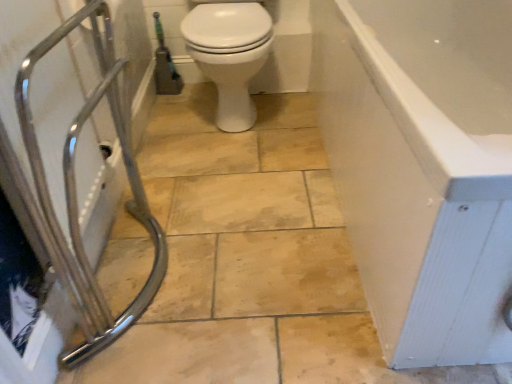
This screenshot has height=384, width=512. I want to click on white glossy toilet at center, so click(x=230, y=55).

What do you see at coordinates (423, 167) in the screenshot? I see `white glossy bathtub at right` at bounding box center [423, 167].

Image resolution: width=512 pixels, height=384 pixels. In order to click on chrome metallic shower at left in this screenshot , I will do `click(75, 185)`.

Identify the location of garden hose behind the chrome metallic shower at left. [x=165, y=65].

Does green rubber garden hose at upper left appear on the left side of chrome metallic shower at left?

Indeed, green rubber garden hose at upper left is positioned on the left side of chrome metallic shower at left.

Which is less distant, (159, 50) or (68, 214)?

The point (68, 214) is in front.

Does green rubber garden hose at upper left have a lesser width compared to chrome metallic shower at left?

Correct, the width of green rubber garden hose at upper left is less than that of chrome metallic shower at left.

Considering the relative positions of white glossy bathtub at right and chrome metallic shower at left in the image provided, is white glossy bathtub at right to the left or to the right of chrome metallic shower at left?

Clearly, white glossy bathtub at right is on the right of chrome metallic shower at left in the image.

Is white glossy bathtub at right oriented towards chrome metallic shower at left?

Yes, white glossy bathtub at right faces towards chrome metallic shower at left.

Considering their positions, is white glossy bathtub at right located in front of or behind chrome metallic shower at left?

In the image, white glossy bathtub at right appears behind chrome metallic shower at left.

How many degrees apart are the facing directions of white glossy bathtub at right and chrome metallic shower at left?

There is a 179-degree angle between the facing directions of white glossy bathtub at right and chrome metallic shower at left.

Considering the relative positions of green rubber garden hose at upper left and white glossy bathtub at right in the image provided, is green rubber garden hose at upper left behind white glossy bathtub at right?

That is True.

Is green rubber garden hose at upper left located outside white glossy bathtub at right?

Yes.

From the image's perspective, relative to white glossy bathtub at right, is green rubber garden hose at upper left above or below?

From the image's perspective, green rubber garden hose at upper left appears above white glossy bathtub at right.

At what (x,y) coordinates should I click in order to perform the action: click on garden hose located on the left of white glossy bathtub at right. Please return your answer as a coordinate pair (x, y). The image size is (512, 384). Looking at the image, I should click on [x=165, y=65].

Does point (236, 23) lie behind point (413, 248)?

That is True.

Is white glossy toilet at center aimed at white glossy bathtub at right?

No.

Is white glossy toilet at center far from white glossy bathtub at right?

They are positioned close to each other.

Is white glossy toilet at center bigger than white glossy bathtub at right?

Incorrect, white glossy toilet at center is not larger than white glossy bathtub at right.

Does white glossy bathtub at right have a smaller size compared to white glossy toilet at center?

Actually, white glossy bathtub at right might be larger than white glossy toilet at center.

You are a GUI agent. You are given a task and a screenshot of the screen. Output one action in this format:
    pyautogui.click(x=<x>, y=<y>)
    Task: Click on the bathtub located underneath the white glossy toilet at center (from a real-world perspective)
    This screenshot has height=384, width=512.
    Given the screenshot: What is the action you would take?
    pyautogui.click(x=423, y=167)

Is white glossy bathtub at right shorter than white glossy toilet at center?

Yes, white glossy bathtub at right is shorter than white glossy toilet at center.

Is point (78, 349) in front of point (247, 58)?

That is True.

How different are the orientations of chrome metallic shower at left and white glossy toilet at center in degrees?

The angle between the facing direction of chrome metallic shower at left and the facing direction of white glossy toilet at center is 89.8 degrees.

Is chrome metallic shower at left completely or partially outside of white glossy toilet at center?

Yes.

Is chrome metallic shower at left placed right next to white glossy toilet at center?

There is a gap between chrome metallic shower at left and white glossy toilet at center.

Does white glossy toilet at center have a lesser width compared to chrome metallic shower at left?

Incorrect, the width of white glossy toilet at center is not less than that of chrome metallic shower at left.

Does white glossy toilet at center come behind chrome metallic shower at left?

Yes, the depth of white glossy toilet at center is greater than that of chrome metallic shower at left.

Can you confirm if white glossy toilet at center is bigger than chrome metallic shower at left?

Yes, white glossy toilet at center is bigger than chrome metallic shower at left.

Where is `shower in front of the green rubber garden hose at upper left`? Image resolution: width=512 pixels, height=384 pixels. shower in front of the green rubber garden hose at upper left is located at coordinates (75, 185).

Locate an element on the screen. The image size is (512, 384). shower above the white glossy bathtub at right (from a real-world perspective) is located at coordinates (75, 185).

Considering their positions, is chrome metallic shower at left positioned further to white glossy toilet at center than white glossy bathtub at right?

white glossy bathtub at right is positioned further to the anchor white glossy toilet at center.

Based on their spatial positions, is chrome metallic shower at left or green rubber garden hose at upper left closer to white glossy bathtub at right?

Based on the image, chrome metallic shower at left appears to be nearer to white glossy bathtub at right.

Estimate the real-world distances between objects in this image. Which object is further from white glossy toilet at center, chrome metallic shower at left or green rubber garden hose at upper left?

green rubber garden hose at upper left is positioned further to the anchor white glossy toilet at center.

Considering their positions, is white glossy toilet at center positioned further to white glossy bathtub at right than chrome metallic shower at left?

Based on the image, chrome metallic shower at left appears to be further to white glossy bathtub at right.

Which object lies nearer to the anchor point green rubber garden hose at upper left, white glossy bathtub at right or white glossy toilet at center?

white glossy toilet at center.

From the picture: Looking at the image, which one is located further to chrome metallic shower at left, white glossy toilet at center or green rubber garden hose at upper left?

green rubber garden hose at upper left.

Considering their positions, is white glossy bathtub at right positioned further to white glossy toilet at center than chrome metallic shower at left?

The object further to white glossy toilet at center is white glossy bathtub at right.

Based on their spatial positions, is chrome metallic shower at left or white glossy toilet at center closer to green rubber garden hose at upper left?

white glossy toilet at center lies closer to green rubber garden hose at upper left than the other object.

Identify the location of bathtub between chrome metallic shower at left and green rubber garden hose at upper left from front to back. (423, 167).

Identify the location of toilet located between chrome metallic shower at left and green rubber garden hose at upper left in the depth direction. The height and width of the screenshot is (384, 512). (230, 55).

Find the location of a particular element. This screenshot has height=384, width=512. toilet located between white glossy bathtub at right and green rubber garden hose at upper left in the depth direction is located at coordinates tap(230, 55).

Locate an element on the screen. The height and width of the screenshot is (384, 512). toilet between chrome metallic shower at left and white glossy bathtub at right in the horizontal direction is located at coordinates (230, 55).